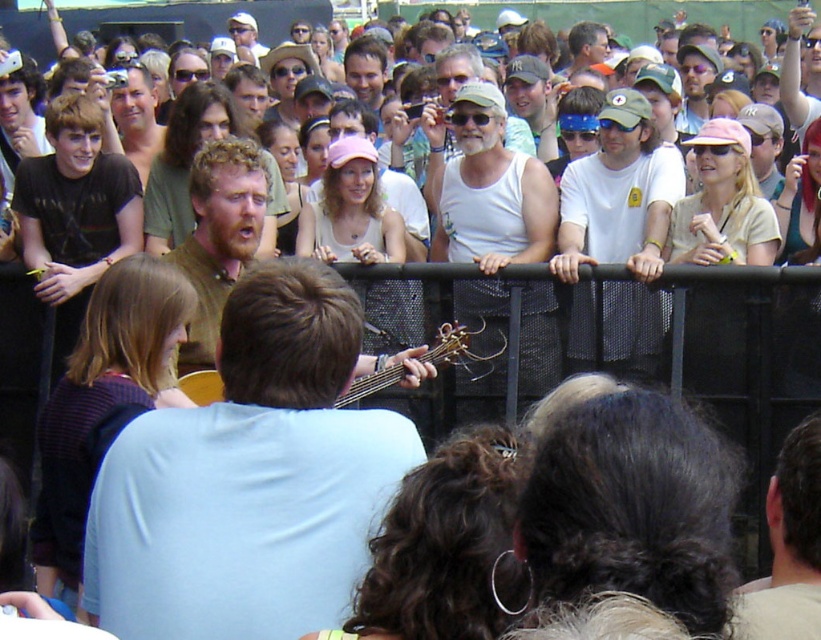
Does brown wood guitar at center have a greater width compared to white cotton t-shirt at center?

No, brown wood guitar at center is not wider than white cotton t-shirt at center.

Is point (273, 356) positioned behind point (569, 256)?

No, (273, 356) is in front of (569, 256).

At what (x,y) coordinates should I click in order to perform the action: click on brown wood guitar at center. Please return your answer as a coordinate pair (x, y). Looking at the image, I should click on (250, 477).

Does striped sweater at left have a greater height compared to matte brown shirt at center?

Yes, striped sweater at left is taller than matte brown shirt at center.

Is striped sweater at left to the right of matte brown shirt at center from the viewer's perspective?

Indeed, striped sweater at left is positioned on the right side of matte brown shirt at center.

Where is `striped sweater at left`? striped sweater at left is located at coordinates [x=102, y=397].

This screenshot has height=640, width=821. What are the coordinates of `striped sweater at left` in the screenshot? It's located at (102, 397).

Does matte black t-shirt at left have a greater height compared to brown leather jacket at upper center?

Correct, matte black t-shirt at left is much taller as brown leather jacket at upper center.

Is point (54, 236) less distant than point (797, 476)?

That is False.

Identify the location of matte black t-shirt at left. This screenshot has height=640, width=821. (74, 214).